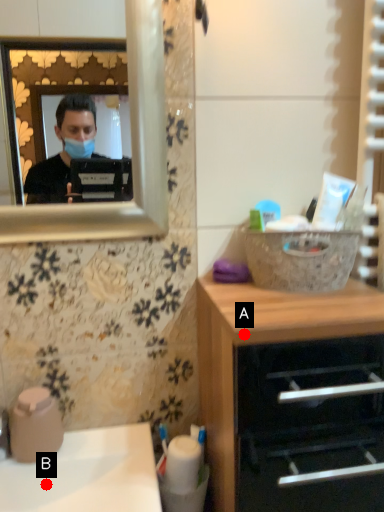
Question: Two points are circled on the image, labeled by A and B beside each circle. Among these points, which one is nearest to the camera?

Choices:
 (A) A is closer
 (B) B is closer

Answer: (A)